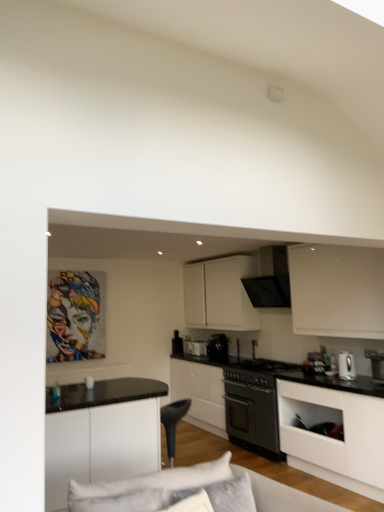
You are a GUI agent. You are given a task and a screenshot of the screen. Output one action in this format:
    pyautogui.click(x=<x>, y=<y>)
    Task: Click on the white matte cabinet at upper center, the 1th cabinetry viewed from the back
    This screenshot has width=384, height=512.
    Given the screenshot: What is the action you would take?
    pyautogui.click(x=220, y=294)

What is the approximate width of white glossy electric kettle at right?

white glossy electric kettle at right is 7.00 inches wide.

What is the approximate height of black matte oven at center?

The height of black matte oven at center is 30.02 inches.

Find the location of a particular element. The height and width of the screenshot is (512, 384). black matte exhaust hood at upper center is located at coordinates (270, 280).

What do you see at coordinates (376, 362) in the screenshot?
I see `white glossy kettle at right, the fifth appliance viewed from the left` at bounding box center [376, 362].

The image size is (384, 512). Identify the location of white glossy kettle at right, the fifth appliance viewed from the left. (376, 362).

At what (x,y) coordinates should I click in order to perform the action: click on white matte cabinet at upper center, the 1th cabinetry viewed from the back. Please return your answer as a coordinate pair (x, y). The image size is (384, 512). Looking at the image, I should click on (220, 294).

Considering the relative positions of black matte oven at center, which ranks as the 2th cabinetry in front-to-back order, and black matte oven at center, placed as the second appliance when sorted from right to left, in the image provided, is black matte oven at center, which ranks as the 2th cabinetry in front-to-back order, to the right of black matte oven at center, placed as the second appliance when sorted from right to left, from the viewer's perspective?

Incorrect, black matte oven at center, which ranks as the 2th cabinetry in front-to-back order, is not on the right side of black matte oven at center, placed as the second appliance when sorted from right to left.

Can you confirm if black matte oven at center, the second cabinetry in the back-to-front sequence, is shorter than black matte oven at center, which is the second appliance from front to back?

In fact, black matte oven at center, the second cabinetry in the back-to-front sequence, may be taller than black matte oven at center, which is the second appliance from front to back.

Is point (220, 369) in front of point (248, 378)?

That is False.

From the image's perspective, would you say black matte oven at center, which ranks as the 2th cabinetry in front-to-back order, is positioned over black matte oven at center, arranged as the 4th appliance when viewed from the back?

No.

Which is behind, black matte exhaust hood at upper center or white glossy electric kettle at right?

black matte exhaust hood at upper center is more distant.

Can you confirm if black matte exhaust hood at upper center is shorter than white glossy electric kettle at right?

No.

From a real-world perspective, relative to white glossy electric kettle at right, is black matte exhaust hood at upper center vertically above or below?

In terms of real-world spatial position, black matte exhaust hood at upper center is above white glossy electric kettle at right.

How distant is black matte oven at center, arranged as the 4th appliance when viewed from the back, from white fabric couch at lower center?

black matte oven at center, arranged as the 4th appliance when viewed from the back, and white fabric couch at lower center are 8.00 feet apart from each other.

Is white fabric couch at lower center at the back of black matte oven at center, arranged as the 4th appliance when viewed from the back?

No, black matte oven at center, arranged as the 4th appliance when viewed from the back, is not facing the opposite direction of white fabric couch at lower center.

Consider the image. Can you confirm if black matte oven at center, positioned as the 4th appliance in left-to-right order, is shorter than white fabric couch at lower center?

Yes, black matte oven at center, positioned as the 4th appliance in left-to-right order, is shorter than white fabric couch at lower center.

Which cabinetry is the 1st one when counting from the left side of the black matte oven at center? Please provide its 2D coordinates.

[(220, 294)]

Looking at this image, from the image's perspective, is white matte cabinet at upper center, the 1th cabinetry viewed from the back, above black matte oven at center?

Yes, from the image's perspective, white matte cabinet at upper center, the 1th cabinetry viewed from the back, is above black matte oven at center.

Does point (191, 272) come behind point (265, 396)?

That is True.

Can we say white matte cabinet at upper center, marked as the 3th cabinetry in a front-to-back arrangement, lies outside black matte oven at center?

white matte cabinet at upper center, marked as the 3th cabinetry in a front-to-back arrangement, lies outside black matte oven at center's area.

Is point (246, 498) behind point (263, 282)?

No, (246, 498) is closer to viewer.

From a real-world perspective, is soft gray fabric pillow at lower center below black matte exhaust hood at upper center?

Correct, in the physical world, soft gray fabric pillow at lower center is lower than black matte exhaust hood at upper center.

Is soft gray fabric pillow at lower center directly adjacent to black matte exhaust hood at upper center?

No.

Is soft gray fabric pillow at lower center completely or partially outside of black matte exhaust hood at upper center?

That's correct, soft gray fabric pillow at lower center is outside of black matte exhaust hood at upper center.

Which of these two, white matte cabinet at lower right, positioned as the 1th cabinetry in front-to-back order, or white fabric couch at lower center, is wider?

Wider between the two is white fabric couch at lower center.

From a real-world perspective, is white matte cabinet at lower right, which appears as the 3th cabinetry when viewed from the back, physically above white fabric couch at lower center?

No.

Is there a large distance between white matte cabinet at lower right, positioned as the 1th cabinetry in front-to-back order, and white fabric couch at lower center?

Absolutely, white matte cabinet at lower right, positioned as the 1th cabinetry in front-to-back order, is distant from white fabric couch at lower center.

Is point (342, 364) more distant than point (288, 486)?

Yes, point (342, 364) is behind point (288, 486).

How far apart are white glossy electric kettle at right and white fabric couch at lower center?

white glossy electric kettle at right is 2.46 meters away from white fabric couch at lower center.

The height and width of the screenshot is (512, 384). I want to click on couch below the white glossy electric kettle at right (from the image's perspective), so click(x=207, y=487).

Are white glossy electric kettle at right and white fabric couch at lower center far apart?

That's right, there is a large distance between white glossy electric kettle at right and white fabric couch at lower center.

From the black matte oven at center, the second cabinetry in the back-to-front sequence, count 2nd appliance to the right and point to it. Please provide its 2D coordinates.

[(257, 371)]

Find the location of a particular element. The height and width of the screenshot is (512, 384). kitchen appliance below the black matte exhaust hood at upper center (from the image's perspective) is located at coordinates (346, 366).

Considering their positions, is black matte oven at center, the second cabinetry in the back-to-front sequence, positioned further to white matte cabinet at upper center, the 1th cabinetry viewed from the back, than white glossy toaster at center, the 5th appliance when ordered from right to left?

Among the two, black matte oven at center, the second cabinetry in the back-to-front sequence, is located further to white matte cabinet at upper center, the 1th cabinetry viewed from the back.

From the image, which object appears to be nearer to black matte oven at center, black glossy coffee maker at center, marked as the third appliance in a right-to-left arrangement, or black matte oven at center, positioned as the 4th appliance in left-to-right order?

Based on the image, black matte oven at center, positioned as the 4th appliance in left-to-right order, appears to be nearer to black matte oven at center.

Considering their positions, is black glossy coffee maker at center, marked as the third appliance in a right-to-left arrangement, positioned closer to white glossy toaster at center, which is the fifth appliance from front to back, than black matte oven at center?

Result: The object closer to white glossy toaster at center, which is the fifth appliance from front to back, is black glossy coffee maker at center, marked as the third appliance in a right-to-left arrangement.

Based on their spatial positions, is soft gray fabric pillow at lower center or white matte cabinet at upper center, marked as the 3th cabinetry in a front-to-back arrangement, further from black matte exhaust hood at upper center?

Among the two, soft gray fabric pillow at lower center is located further to black matte exhaust hood at upper center.

Which object lies further to the anchor point white matte cabinet at lower right, which appears as the 3th cabinetry when viewed from the back, white glossy toaster at center, which is the fifth appliance from front to back, or white fabric couch at lower center?

white glossy toaster at center, which is the fifth appliance from front to back, lies further to white matte cabinet at lower right, which appears as the 3th cabinetry when viewed from the back, than the other object.

Estimate the real-world distances between objects in this image. Which object is closer to white glossy toaster at center, the 5th appliance when ordered from right to left, black plastic swivel chair at center or white glossy electric kettle at right?

Among the two, black plastic swivel chair at center is located nearer to white glossy toaster at center, the 5th appliance when ordered from right to left.

Based on their spatial positions, is white matte cabinet at upper center, the 1th cabinetry viewed from the back, or white glossy electric kettle at right further from black matte oven at center, positioned as the 4th appliance in left-to-right order?

The object further to black matte oven at center, positioned as the 4th appliance in left-to-right order, is white matte cabinet at upper center, the 1th cabinetry viewed from the back.

Estimate the real-world distances between objects in this image. Which object is further from white glossy electric kettle at right, white matte cabinet at lower right, which appears as the 3th cabinetry when viewed from the back, or white fabric couch at lower center?

white fabric couch at lower center is further to white glossy electric kettle at right.

Locate an element on the screen. exhaust hood between soft gray fabric pillow at lower center and satin silver toaster at center, the fourth appliance positioned from the front, along the z-axis is located at coordinates (270, 280).

Image resolution: width=384 pixels, height=512 pixels. Find the location of `kitchen appliance between black plastic swivel chair at center and white glossy kettle at right, the fifth appliance viewed from the left, from left to right`. kitchen appliance between black plastic swivel chair at center and white glossy kettle at right, the fifth appliance viewed from the left, from left to right is located at coordinates (346, 366).

Identify the location of cabinetry between soft gray fabric pillow at lower center and black plastic swivel chair at center in the front-back direction. This screenshot has height=512, width=384. (334, 439).

Find the location of a particular element. home appliance located between black plastic swivel chair at center and white glossy toaster at center, the first appliance from the back, in the depth direction is located at coordinates (252, 412).